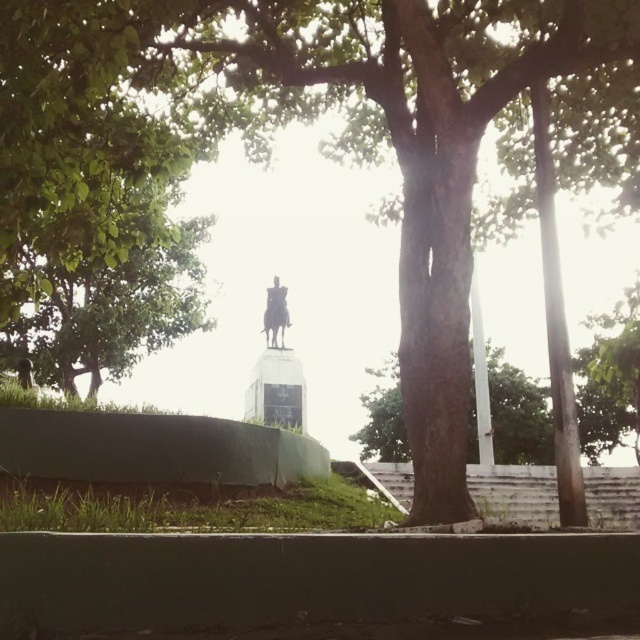
Between point (381, 401) and point (262, 326), which one is positioned behind?

Positioned behind is point (381, 401).

Is brown rough tree trunk at center below metallic statue at center?

Yes.

You are a GUI agent. You are given a task and a screenshot of the screen. Output one action in this format:
    pyautogui.click(x=<x>, y=<y>)
    Task: Click on the brown rough tree trunk at center
    Image resolution: width=640 pixels, height=640 pixels.
    Given the screenshot: What is the action you would take?
    pyautogui.click(x=516, y=413)

This screenshot has width=640, height=640. In order to click on brown rough tree trunk at center in this screenshot , I will do `click(516, 413)`.

Looking at this image, can you confirm if brown rough tree trunk at center is positioned above white concrete stairs at lower center?

Incorrect, brown rough tree trunk at center is not positioned above white concrete stairs at lower center.

Is point (380, 419) less distant than point (600, 509)?

No, (380, 419) is behind (600, 509).

The width and height of the screenshot is (640, 640). Describe the element at coordinates (516, 413) in the screenshot. I see `brown rough tree trunk at center` at that location.

This screenshot has width=640, height=640. What are the coordinates of `brown rough tree trunk at center` in the screenshot? It's located at (516, 413).

The height and width of the screenshot is (640, 640). I want to click on white concrete stairs at lower center, so click(x=515, y=493).

Does white concrete stairs at lower center have a greater height compared to metallic statue at center?

No, white concrete stairs at lower center is not taller than metallic statue at center.

Locate an element on the screen. white concrete stairs at lower center is located at coordinates (515, 493).

Where is `white concrete stairs at lower center`? The image size is (640, 640). white concrete stairs at lower center is located at coordinates (515, 493).